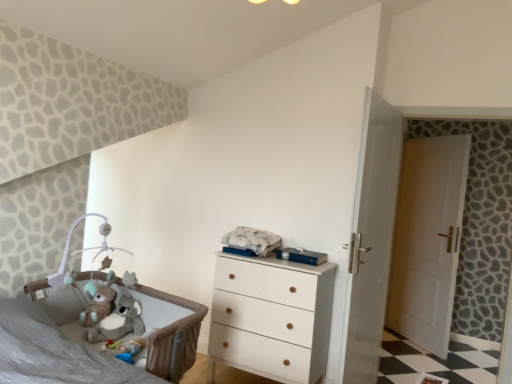
Find the location of a particular element. This screenshot has height=384, width=512. white wooden door at right is located at coordinates (426, 240).

Where is `white glossy door at center`? white glossy door at center is located at coordinates (370, 240).

The height and width of the screenshot is (384, 512). I want to click on soft gray fabric infant bed at lower left, so click(x=87, y=348).

Is fluffy plush koala at lower left further to the viewer compared to white wooden door at right?

No, fluffy plush koala at lower left is in front of white wooden door at right.

From a real-world perspective, who is located higher, fluffy plush koala at lower left or white wooden door at right?

From a 3D spatial view, white wooden door at right is above.

From the image's perspective, which object appears higher, fluffy plush koala at lower left or white wooden door at right?

white wooden door at right.

Is fluffy plush koala at lower left not within white wooden door at right?

Yes, fluffy plush koala at lower left is not within white wooden door at right.

From the image's perspective, does white wooden door at right appear higher than soft gray fabric infant bed at lower left?

Yes, from the image's perspective, white wooden door at right is above soft gray fabric infant bed at lower left.

Are white wooden door at right and soft gray fabric infant bed at lower left making contact?

They are not placed beside each other.

From a real-world perspective, who is located lower, white wooden door at right or soft gray fabric infant bed at lower left?

soft gray fabric infant bed at lower left is physically lower.

Considering the sizes of white wooden door at right and soft gray fabric infant bed at lower left in the image, is white wooden door at right bigger or smaller than soft gray fabric infant bed at lower left?

white wooden door at right is smaller than soft gray fabric infant bed at lower left.

From the image's perspective, is white wood chest of drawers at center above or below white glossy door at center?

Based on their image positions, white wood chest of drawers at center is located beneath white glossy door at center.

Which is behind, white wood chest of drawers at center or white glossy door at center?

white wood chest of drawers at center is more distant.

Between white wood chest of drawers at center and white glossy door at center, which one appears on the left side from the viewer's perspective?

From the viewer's perspective, white wood chest of drawers at center appears more on the left side.

From a real-world perspective, which is physically above, white wood chest of drawers at center or white glossy door at center?

white glossy door at center.

The width and height of the screenshot is (512, 384). I want to click on infant bed on the left of the white wooden door at right, so click(x=87, y=348).

Looking at the image, does soft gray fabric infant bed at lower left seem bigger or smaller compared to white wooden door at right?

Clearly, soft gray fabric infant bed at lower left is larger in size than white wooden door at right.

Would you consider soft gray fabric infant bed at lower left to be distant from white wooden door at right?

Yes, soft gray fabric infant bed at lower left and white wooden door at right are located far from each other.

Is soft gray fabric infant bed at lower left next to white wood chest of drawers at center and touching it?

There is a gap between soft gray fabric infant bed at lower left and white wood chest of drawers at center.

Can you confirm if soft gray fabric infant bed at lower left is positioned to the left of white wood chest of drawers at center?

Correct, you'll find soft gray fabric infant bed at lower left to the left of white wood chest of drawers at center.

Does white wooden door at right have a greater height compared to white wood chest of drawers at center?

Yes, white wooden door at right is taller than white wood chest of drawers at center.

In the image, there is a white wood chest of drawers at center. Where is `door above it (from the image's perspective)`? This screenshot has height=384, width=512. door above it (from the image's perspective) is located at coordinates (426, 240).

Is point (445, 250) positioned in front of point (320, 268)?

No, it is not.

Considering the sizes of objects white wooden door at right and white wood chest of drawers at center in the image provided, who is thinner, white wooden door at right or white wood chest of drawers at center?

white wooden door at right is thinner.

Which of these two, fluffy plush koala at lower left or soft gray fabric infant bed at lower left, is thinner?

fluffy plush koala at lower left.

Is fluffy plush koala at lower left to the right of soft gray fabric infant bed at lower left from the viewer's perspective?

No, fluffy plush koala at lower left is not to the right of soft gray fabric infant bed at lower left.

Find the location of a particular element. This screenshot has height=384, width=512. animal above the soft gray fabric infant bed at lower left (from a real-world perspective) is located at coordinates (118, 322).

From a real-world perspective, which object rests below the other?

soft gray fabric infant bed at lower left is physically lower.

At what (x,y) coordinates should I click in order to perform the action: click on door on the right of fluffy plush koala at lower left. Please return your answer as a coordinate pair (x, y). Image resolution: width=512 pixels, height=384 pixels. Looking at the image, I should click on (426, 240).

This screenshot has height=384, width=512. Find the location of `door above the soft gray fabric infant bed at lower left (from a real-world perspective)`. door above the soft gray fabric infant bed at lower left (from a real-world perspective) is located at coordinates (426, 240).

Looking at the image, which one is located further to soft gray fabric infant bed at lower left, white glossy door at center or white wood chest of drawers at center?

white glossy door at center.

From the image, which object appears to be farther from fluffy plush koala at lower left, white glossy door at center or white wooden door at right?

white wooden door at right is positioned further to the anchor fluffy plush koala at lower left.

When comparing their distances from soft gray fabric infant bed at lower left, does white glossy door at center or white wooden door at right seem further?

white wooden door at right.

From the image, which object appears to be farther from white wooden door at right, white glossy door at center or white wood chest of drawers at center?

white wood chest of drawers at center is further to white wooden door at right.

When comparing their distances from soft gray fabric infant bed at lower left, does fluffy plush koala at lower left or white glossy door at center seem further?

The object further to soft gray fabric infant bed at lower left is white glossy door at center.

When comparing their distances from white glossy door at center, does white wooden door at right or fluffy plush koala at lower left seem closer?

white wooden door at right lies closer to white glossy door at center than the other object.

From the image, which object appears to be nearer to soft gray fabric infant bed at lower left, white wooden door at right or white wood chest of drawers at center?

The object closer to soft gray fabric infant bed at lower left is white wood chest of drawers at center.

When comparing their distances from white wooden door at right, does fluffy plush koala at lower left or white wood chest of drawers at center seem further?

The object further to white wooden door at right is fluffy plush koala at lower left.

Locate an element on the screen. This screenshot has height=384, width=512. infant bed between fluffy plush koala at lower left and white wooden door at right from left to right is located at coordinates (87, 348).

This screenshot has height=384, width=512. What are the coordinates of `infant bed between fluffy plush koala at lower left and white glossy door at center from left to right` in the screenshot? It's located at (87, 348).

In order to click on screen door situated between soft gray fabric infant bed at lower left and white wooden door at right from left to right in this screenshot , I will do `click(370, 240)`.

I want to click on chest of drawers between soft gray fabric infant bed at lower left and white wooden door at right from left to right, so click(272, 317).